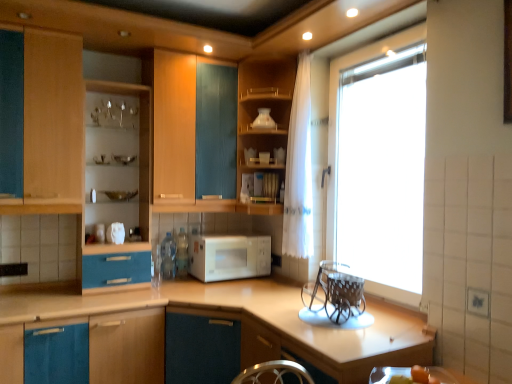
Question: Is white glossy vase at upper center, which is the first appliance from left to right, located outside matte wood shelves at center, acting as the second cabinetry starting from the left?

Choices:
 (A) yes
 (B) no

Answer: (A)

Question: Is white glossy vase at upper center, which is counted as the 2th appliance, starting from the right, oriented towards matte wood shelves at center, acting as the second cabinetry starting from the left?

Choices:
 (A) yes
 (B) no

Answer: (B)

Question: Can you confirm if white glossy vase at upper center, which is counted as the 1th appliance, starting from the back, is positioned to the left of matte wood shelves at center, which ranks as the second cabinetry in right-to-left order?

Choices:
 (A) no
 (B) yes

Answer: (A)

Question: Is white glossy vase at upper center, the 2th appliance in the bottom-to-top sequence, thinner than matte wood shelves at center, which ranks as the second cabinetry in right-to-left order?

Choices:
 (A) yes
 (B) no

Answer: (A)

Question: From the image's perspective, is white glossy vase at upper center, the 2th appliance in the bottom-to-top sequence, below matte wood shelves at center, acting as the second cabinetry starting from the left?

Choices:
 (A) no
 (B) yes

Answer: (A)

Question: Looking at their shapes, would you say wooden cabinet at upper center, marked as the third cabinetry in a left-to-right arrangement, is wider or thinner than transparent glass window at upper right?

Choices:
 (A) wide
 (B) thin

Answer: (A)

Question: From a real-world perspective, relative to transparent glass window at upper right, is wooden cabinet at upper center, which appears as the 1th cabinetry when viewed from the right, vertically above or below?

Choices:
 (A) above
 (B) below

Answer: (A)

Question: Choose the correct answer: Is wooden cabinet at upper center, marked as the third cabinetry in a left-to-right arrangement, inside transparent glass window at upper right or outside it?

Choices:
 (A) outside
 (B) inside

Answer: (A)

Question: In the image, is wooden cabinet at upper center, marked as the third cabinetry in a left-to-right arrangement, positioned in front of or behind transparent glass window at upper right?

Choices:
 (A) behind
 (B) front

Answer: (A)

Question: Does point (326, 218) appear closer or farther from the camera than point (278, 208)?

Choices:
 (A) closer
 (B) farther

Answer: (A)

Question: From a real-world perspective, relative to wooden cabinet at upper center, marked as the third cabinetry in a left-to-right arrangement, is transparent glass window at upper right vertically above or below?

Choices:
 (A) below
 (B) above

Answer: (A)

Question: In terms of width, does transparent glass window at upper right look wider or thinner when compared to wooden cabinet at upper center, marked as the third cabinetry in a left-to-right arrangement?

Choices:
 (A) wide
 (B) thin

Answer: (B)

Question: Choose the correct answer: Is transparent glass window at upper right inside wooden cabinet at upper center, which appears as the 1th cabinetry when viewed from the right, or outside it?

Choices:
 (A) outside
 (B) inside

Answer: (A)

Question: In terms of size, does clear glass basket at right, positioned as the second appliance in back-to-front order, appear bigger or smaller than wooden cabinet at upper center, which appears as the 1th cabinetry when viewed from the right?

Choices:
 (A) big
 (B) small

Answer: (B)

Question: From a real-world perspective, relative to wooden cabinet at upper center, which appears as the 1th cabinetry when viewed from the right, is clear glass basket at right, placed as the first appliance when sorted from front to back, vertically above or below?

Choices:
 (A) above
 (B) below

Answer: (B)